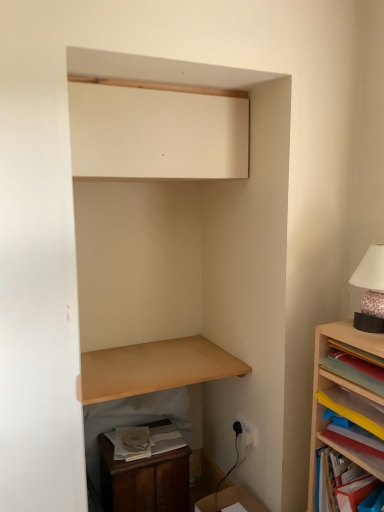
Where is `vacant area on top of white paper at lower left (from a real-world perspective)`? This screenshot has width=384, height=512. vacant area on top of white paper at lower left (from a real-world perspective) is located at coordinates (143, 434).